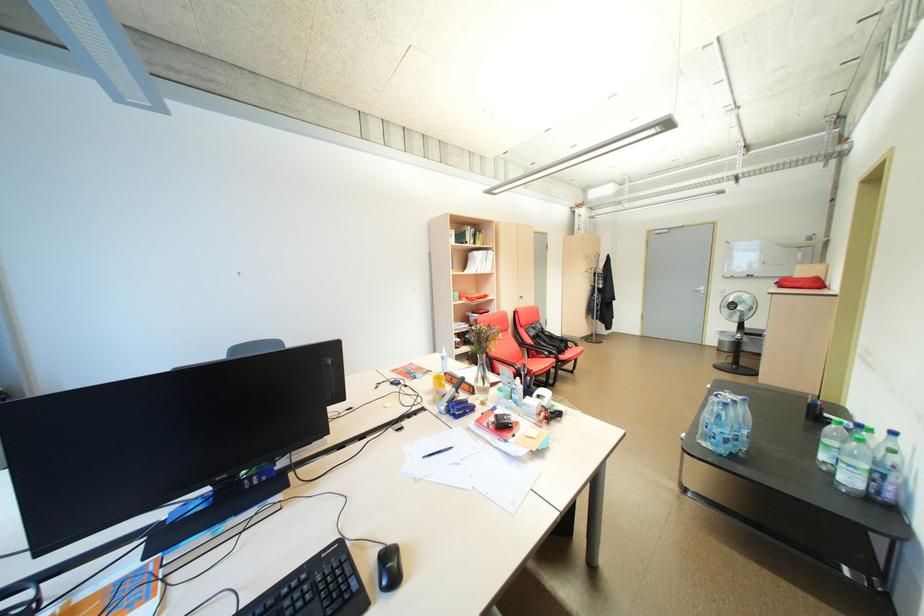
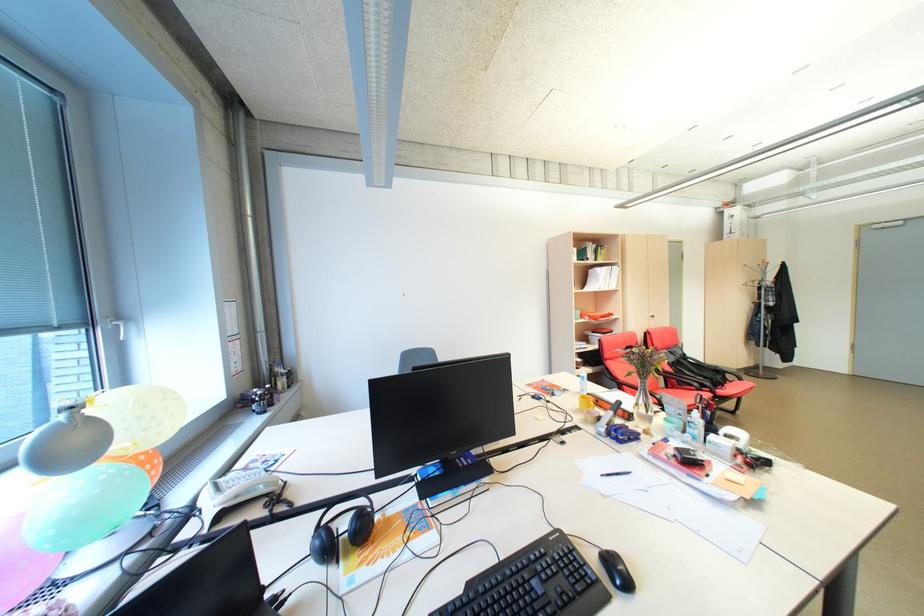
In the second image, find the point that corresponds to (x=176, y=537) in the first image.

(435, 488)